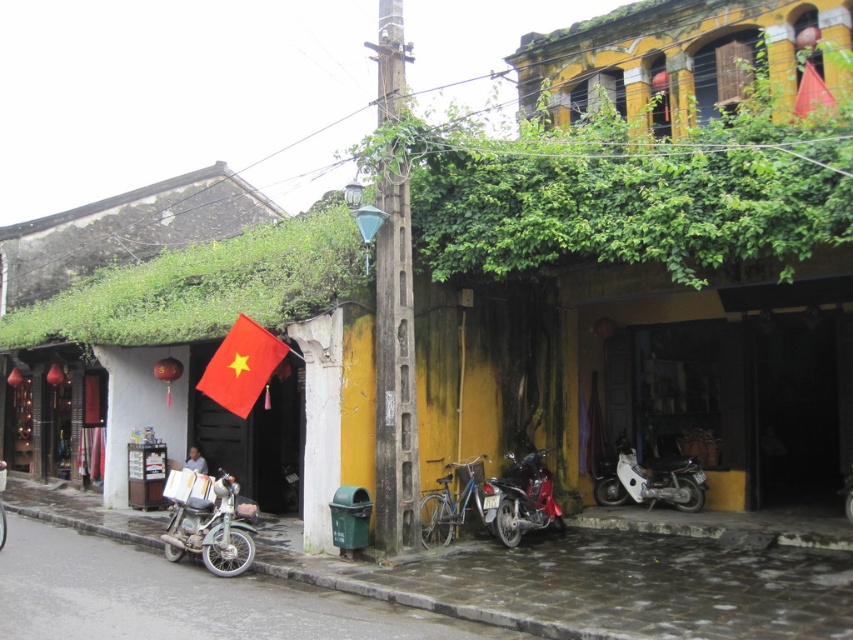
Question: Which point is closer to the camera?

Choices:
 (A) (436, 516)
 (B) (639, 486)

Answer: (A)

Question: Is white matte motorcycle at lower center closer to the viewer compared to blue metallic bicycle at center?

Choices:
 (A) yes
 (B) no

Answer: (B)

Question: Does metallic silver motorcycle at lower left appear under white matte motorcycle at lower center?

Choices:
 (A) no
 (B) yes

Answer: (B)

Question: Which of the following is the closest to the observer?

Choices:
 (A) metallic silver motorcycle at lower left
 (B) wooden pole at center
 (C) red matte flag at center
 (D) green leafy vines at upper center

Answer: (D)

Question: Is wooden pole at center to the left of shiny red motorcycle at center from the viewer's perspective?

Choices:
 (A) no
 (B) yes

Answer: (B)

Question: Which of the following is the farthest from the observer?

Choices:
 (A) (184, 500)
 (B) (379, 412)

Answer: (A)